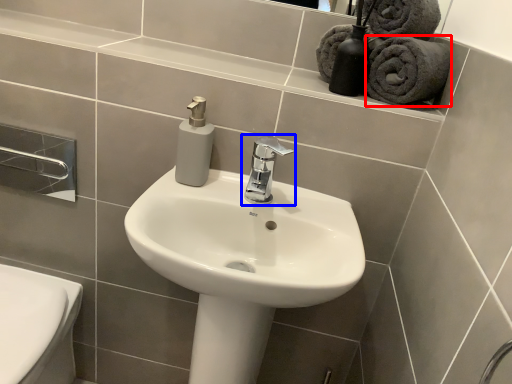
Question: Which object is further to the camera taking this photo, bath towel (highlighted by a red box) or tap (highlighted by a blue box)?

Choices:
 (A) bath towel
 (B) tap

Answer: (A)